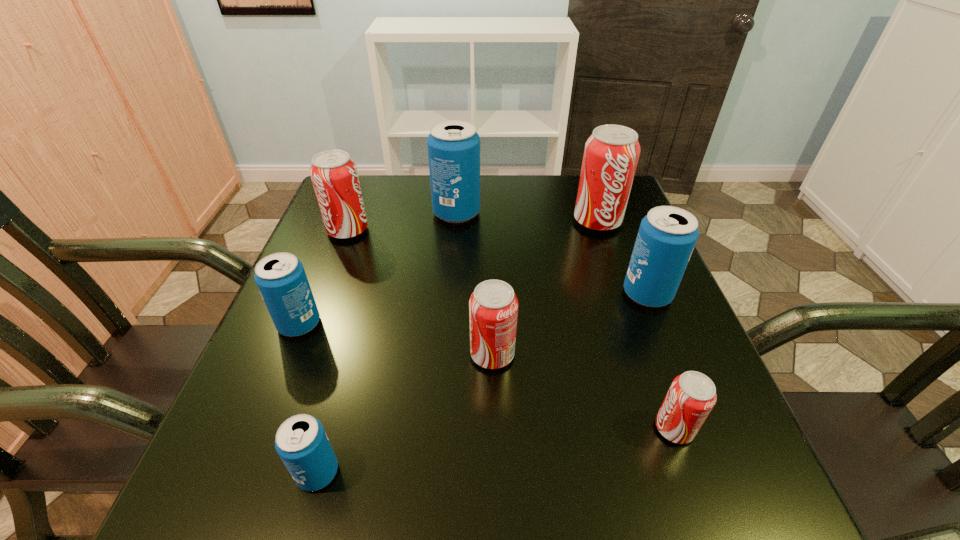
Identify the location of vacant space located on the logo side of the second nearest object. Image resolution: width=960 pixels, height=540 pixels. (623, 428).

At what (x,y) coordinates should I click in order to perform the action: click on blank space located 0.110m on the logo side of the second nearest object. Please return your answer as a coordinate pair (x, y). This screenshot has width=960, height=540. Looking at the image, I should click on (586, 428).

Where is `vacant space located on the logo side of the second nearest object`? Image resolution: width=960 pixels, height=540 pixels. vacant space located on the logo side of the second nearest object is located at coordinates (573, 428).

The height and width of the screenshot is (540, 960). I want to click on vacant area located on the right of the third soda can from left to right, so click(400, 472).

Locate an element on the screen. object present at the near edge is located at coordinates (301, 442).

You are a GUI agent. You are given a task and a screenshot of the screen. Output one action in this format:
    pyautogui.click(x=<x>, y=<y>)
    Task: Click on the object situated at the far left corner
    This screenshot has height=540, width=960.
    Given the screenshot: What is the action you would take?
    pyautogui.click(x=334, y=175)

I want to click on object that is at the near left corner, so click(x=301, y=442).

Where is `object that is at the far right corner`? This screenshot has height=540, width=960. object that is at the far right corner is located at coordinates [x=611, y=154].

You are a GUI agent. You are given a task and a screenshot of the screen. Output one action in this format:
    pyautogui.click(x=<x>, y=<y>)
    Task: Click on the vacant space at the far edge
    
    Given the screenshot: What is the action you would take?
    pyautogui.click(x=405, y=193)

Locate an element on the screen. Image resolution: width=960 pixels, height=540 pixels. free region at the near edge of the desktop is located at coordinates (644, 493).